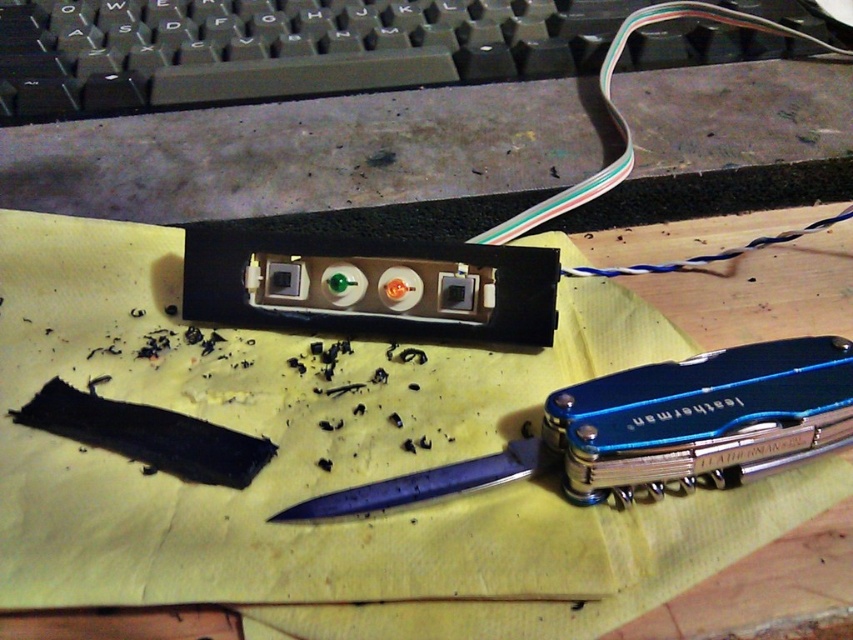
Question: Does black plastic keyboard at upper center have a smaller size compared to matte plastic plug at center?

Choices:
 (A) no
 (B) yes

Answer: (A)

Question: Which object is the farthest from the blue metallic pocketknife at lower center?

Choices:
 (A) yellow paper at center
 (B) matte plastic plug at center

Answer: (B)

Question: Is yellow paper at center to the left of matte plastic plug at center from the viewer's perspective?

Choices:
 (A) yes
 (B) no

Answer: (A)

Question: Which point is closer to the camera taking this photo?

Choices:
 (A) (56, 566)
 (B) (572, 428)
 (C) (262, 280)

Answer: (A)

Question: Which object is the farthest from the black plastic keyboard at upper center?

Choices:
 (A) matte plastic plug at center
 (B) yellow paper at center
 (C) blue metallic pocketknife at lower center

Answer: (C)

Question: Does blue metallic pocketknife at lower center have a smaller size compared to matte plastic plug at center?

Choices:
 (A) yes
 (B) no

Answer: (B)